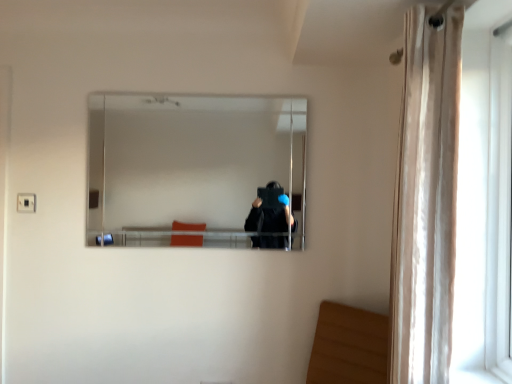
Question: Is beige sheer curtain at right next to clear glass mirror at center?

Choices:
 (A) no
 (B) yes

Answer: (A)

Question: Is beige sheer curtain at right positioned behind clear glass mirror at center?

Choices:
 (A) no
 (B) yes

Answer: (A)

Question: Is beige sheer curtain at right not close to clear glass mirror at center?

Choices:
 (A) yes
 (B) no

Answer: (A)

Question: Is beige sheer curtain at right outside clear glass mirror at center?

Choices:
 (A) no
 (B) yes

Answer: (B)

Question: Is beige sheer curtain at right wider than clear glass mirror at center?

Choices:
 (A) no
 (B) yes

Answer: (B)

Question: From a real-world perspective, is beige sheer curtain at right on top of clear glass mirror at center?

Choices:
 (A) yes
 (B) no

Answer: (B)

Question: Considering the relative sizes of clear glass mirror at center and white plastic screen door at right in the image provided, is clear glass mirror at center taller than white plastic screen door at right?

Choices:
 (A) no
 (B) yes

Answer: (A)

Question: Considering the relative sizes of clear glass mirror at center and white plastic screen door at right in the image provided, is clear glass mirror at center bigger than white plastic screen door at right?

Choices:
 (A) no
 (B) yes

Answer: (A)

Question: Considering the relative sizes of clear glass mirror at center and white plastic screen door at right in the image provided, is clear glass mirror at center smaller than white plastic screen door at right?

Choices:
 (A) no
 (B) yes

Answer: (B)

Question: Is clear glass mirror at center positioned far away from white plastic screen door at right?

Choices:
 (A) yes
 (B) no

Answer: (A)

Question: Does clear glass mirror at center appear on the right side of white plastic screen door at right?

Choices:
 (A) yes
 (B) no

Answer: (B)

Question: Can you confirm if clear glass mirror at center is shorter than white plastic screen door at right?

Choices:
 (A) no
 (B) yes

Answer: (B)

Question: Considering the relative sizes of clear glass mirror at center and beige sheer curtain at right in the image provided, is clear glass mirror at center shorter than beige sheer curtain at right?

Choices:
 (A) yes
 (B) no

Answer: (A)